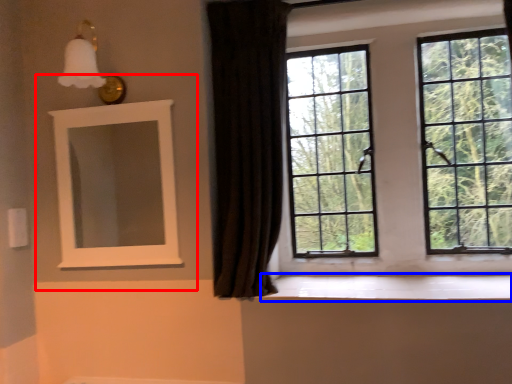
Question: Which of the following is the closest to the observer, medicine cabinet (highlighted by a red box) or window sill (highlighted by a blue box)?

Choices:
 (A) medicine cabinet
 (B) window sill

Answer: (B)